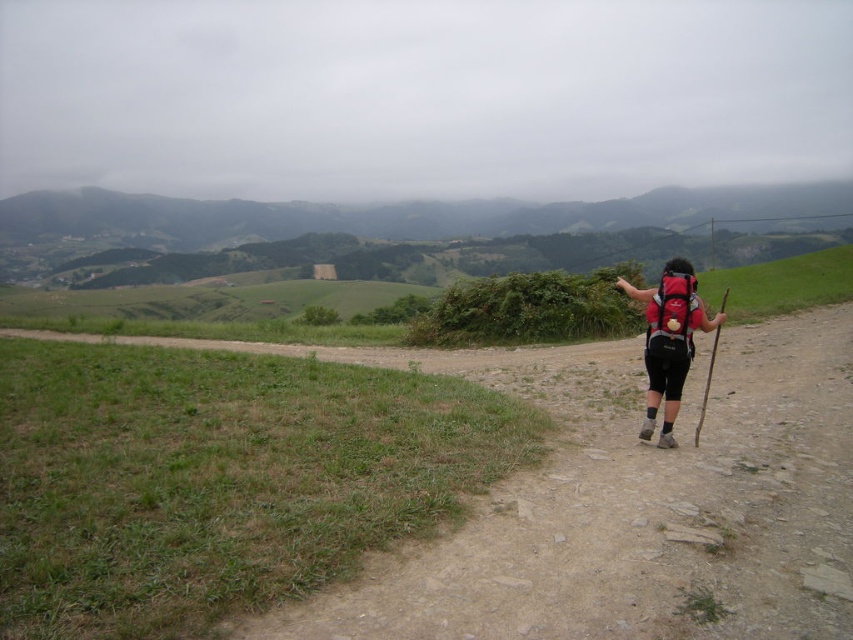
Who is positioned more to the right, dirt path at right or matte red backpack at right?

From the viewer's perspective, matte red backpack at right appears more on the right side.

The height and width of the screenshot is (640, 853). I want to click on dirt path at right, so click(634, 504).

Locate an element on the screen. The width and height of the screenshot is (853, 640). dirt path at right is located at coordinates (634, 504).